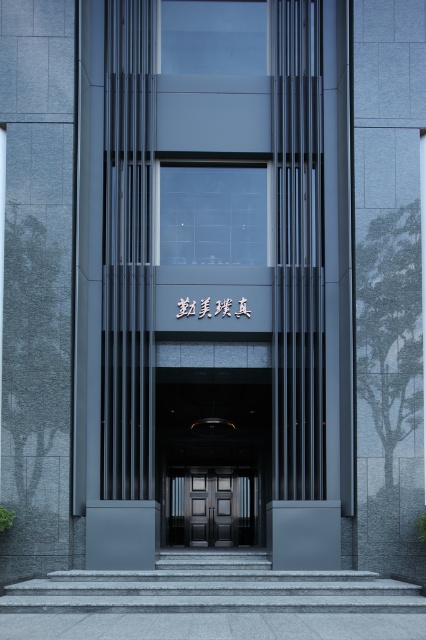
Question: Based on their relative distances, which object is farther from the gray concrete stairs at center?

Choices:
 (A) polished dark wood doors at center
 (B) matte glass entrance at center

Answer: (A)

Question: Can you confirm if matte glass entrance at center is positioned to the left of polished dark wood doors at center?

Choices:
 (A) yes
 (B) no

Answer: (A)

Question: Among these objects, which one is nearest to the camera?

Choices:
 (A) gray concrete stairs at center
 (B) matte glass entrance at center
 (C) polished dark wood doors at center

Answer: (A)

Question: Which of the following is the closest to the observer?

Choices:
 (A) (180, 497)
 (B) (14, 588)
 (C) (167, 173)

Answer: (B)

Question: Does matte glass entrance at center have a lesser width compared to gray concrete stairs at center?

Choices:
 (A) yes
 (B) no

Answer: (A)

Question: Can you confirm if gray concrete stairs at center is wider than polished dark wood doors at center?

Choices:
 (A) no
 (B) yes

Answer: (B)